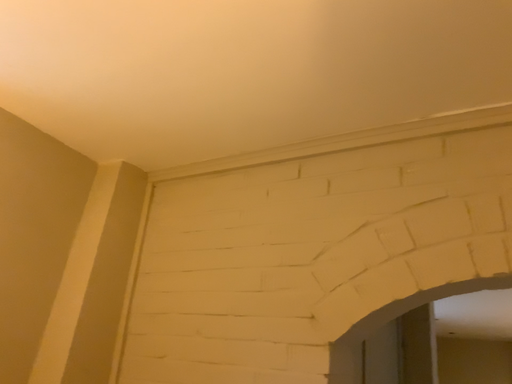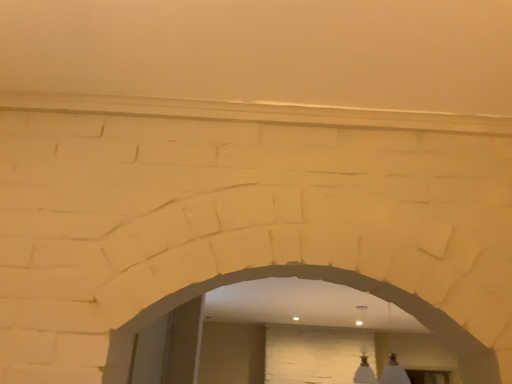
Question: Which way did the camera rotate in the video?

Choices:
 (A) rotated left
 (B) rotated right

Answer: (B)